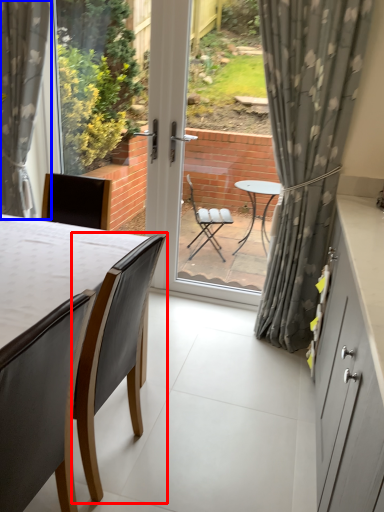
Question: Which object appears closest to the camera in this image, chair (highlighted by a red box) or curtain (highlighted by a blue box)?

Choices:
 (A) chair
 (B) curtain

Answer: (A)